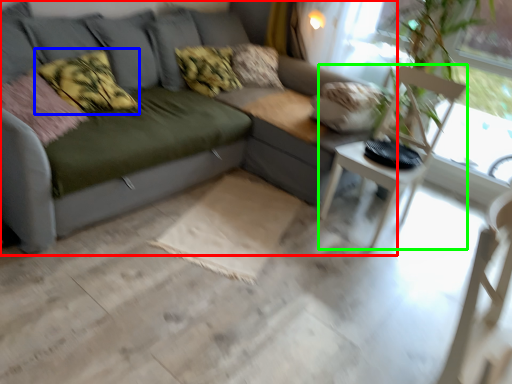
Question: Which object is the closest to the studio couch (highlighted by a red box)? Choose among these: pillow (highlighted by a blue box) or armchair (highlighted by a green box).

Choices:
 (A) pillow
 (B) armchair

Answer: (B)